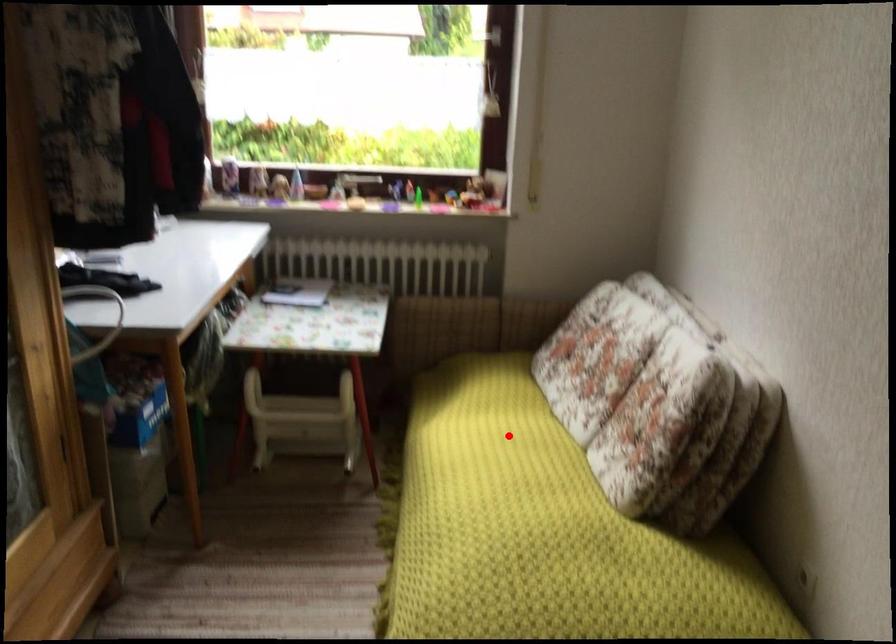
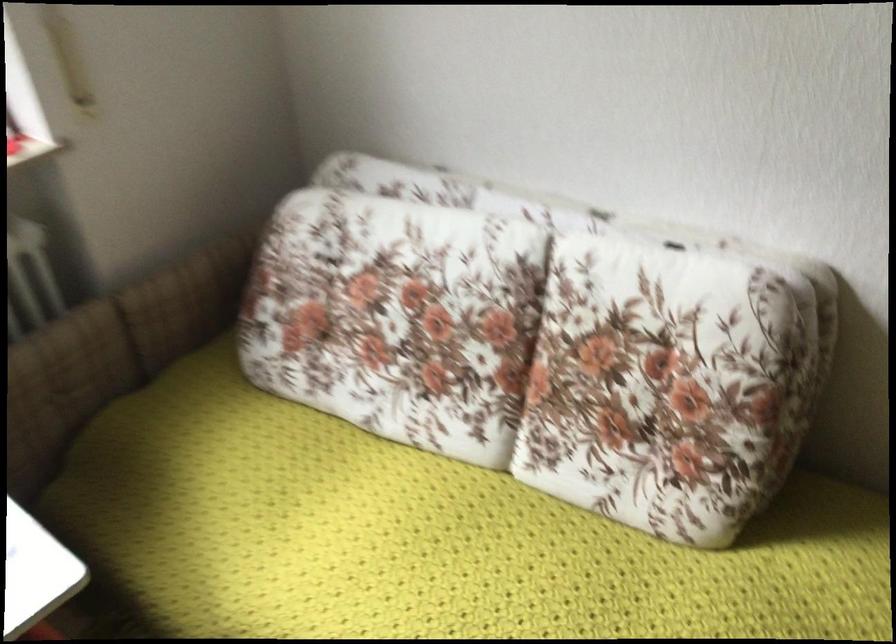
Question: I am providing you with two images of the same scene from different viewpoints. In image1, a red point is highlighted. Considering the same 3D point in image2, which of the following is correct?

Choices:
 (A) It is closer
 (B) It is farther

Answer: (A)